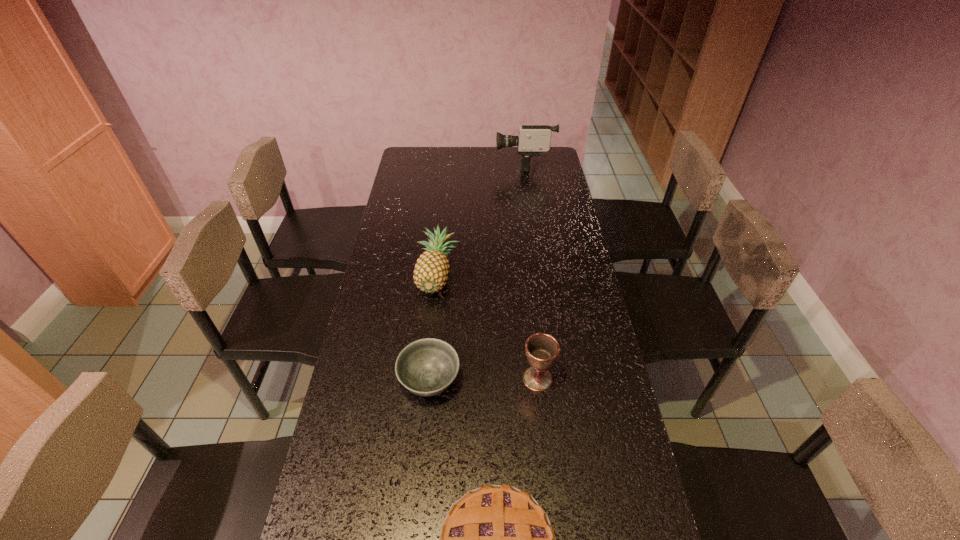
The image size is (960, 540). What are the coordinates of `the tallest object` in the screenshot? It's located at (533, 139).

Where is `the farthest object`? the farthest object is located at coordinates pos(533,139).

Identify the location of chalice. (541, 349).

Locate an element on the screen. This screenshot has height=540, width=960. pineapple is located at coordinates (431, 271).

Where is `bowl`? bowl is located at coordinates (426, 367).

I want to click on free space located on the recording direction of the camcorder, so click(417, 163).

The height and width of the screenshot is (540, 960). What are the coordinates of `free point located on the recording direction of the camcorder` in the screenshot? It's located at (427, 163).

The width and height of the screenshot is (960, 540). In order to click on vacant space located 0.350m on the recording direction of the camcorder in this screenshot , I will do `click(422, 163)`.

The width and height of the screenshot is (960, 540). What are the coordinates of `free space located on the front of the chalice` in the screenshot? It's located at (549, 482).

Identify the location of vacant space located 0.210m on the front of the second farthest object. Image resolution: width=960 pixels, height=540 pixels. (430, 354).